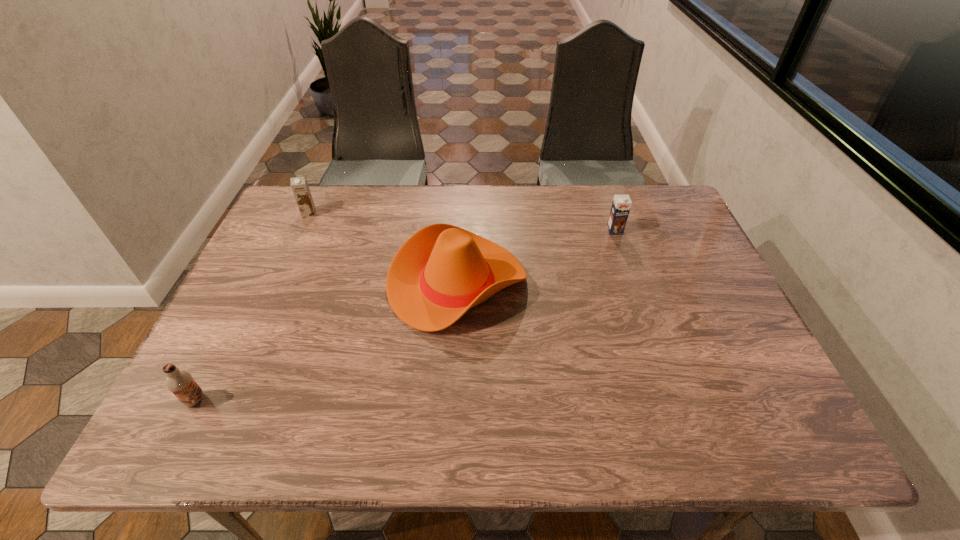
The width and height of the screenshot is (960, 540). In order to click on vacant area located 0.070m on the front label of the second farthest chocolate milk in this screenshot , I will do `click(621, 251)`.

Locate an element on the screen. This screenshot has height=540, width=960. free space located 0.210m on the right of the leftmost object is located at coordinates (306, 400).

Locate an element on the screen. This screenshot has height=540, width=960. object located at the near edge is located at coordinates (180, 382).

At what (x,y) coordinates should I click in order to perform the action: click on object that is at the far left corner. Please return your answer as a coordinate pair (x, y). Looking at the image, I should click on (299, 185).

Where is `object at the near left corner`? This screenshot has height=540, width=960. object at the near left corner is located at coordinates (180, 382).

The width and height of the screenshot is (960, 540). Identify the location of vacant space at the far edge of the desktop. tap(463, 213).

At what (x,y) coordinates should I click in order to perform the action: click on vacant space at the near edge. Please return your answer as a coordinate pair (x, y). This screenshot has height=540, width=960. Looking at the image, I should click on (458, 413).

Image resolution: width=960 pixels, height=540 pixels. What are the coordinates of `vacant region at the left edge` in the screenshot? It's located at (281, 235).

You are a GUI agent. You are given a task and a screenshot of the screen. Output one action in this format:
    pyautogui.click(x=<x>, y=<y>)
    Task: Click on the free space at the right edge of the desktop
    This screenshot has width=960, height=540.
    Given the screenshot: What is the action you would take?
    pyautogui.click(x=710, y=268)

At what (x,y) coordinates should I click in order to perform the action: click on free space at the far left corner of the desktop. Please return your answer as a coordinate pair (x, y). Looking at the image, I should click on (330, 211).